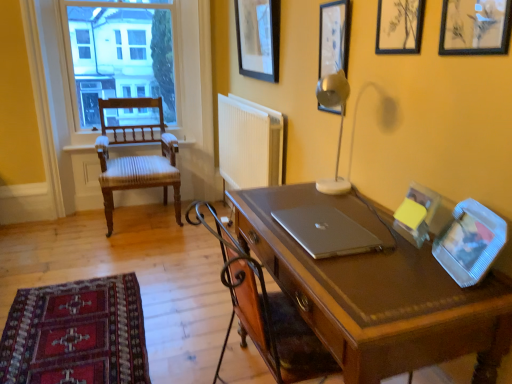
Question: Can you confirm if metallic silver picture frame at upper right, the fourth picture frame viewed from the right, is shorter than metallic silver table lamp at upper right?

Choices:
 (A) yes
 (B) no

Answer: (A)

Question: Can you confirm if metallic silver picture frame at upper right, placed as the fourth picture frame when sorted from front to back, is smaller than metallic silver table lamp at upper right?

Choices:
 (A) no
 (B) yes

Answer: (B)

Question: Can you confirm if metallic silver picture frame at upper right, placed as the fourth picture frame when sorted from front to back, is thinner than metallic silver table lamp at upper right?

Choices:
 (A) no
 (B) yes

Answer: (B)

Question: Can you confirm if metallic silver picture frame at upper right, the fourth picture frame viewed from the right, is wider than metallic silver table lamp at upper right?

Choices:
 (A) yes
 (B) no

Answer: (B)

Question: Does metallic silver picture frame at upper right, the fourth picture frame viewed from the right, lie behind metallic silver table lamp at upper right?

Choices:
 (A) no
 (B) yes

Answer: (B)

Question: Considering their positions, is wooden picture frame at upper right, which is the 3th picture frame in front-to-back order, located in front of or behind wooden chair with striped cushioning at left?

Choices:
 (A) behind
 (B) front

Answer: (B)

Question: Is point (380, 16) positioned closer to the camera than point (164, 162)?

Choices:
 (A) farther
 (B) closer

Answer: (B)

Question: Would you say wooden picture frame at upper right, the 3th picture frame from the left, is to the left or to the right of wooden chair with striped cushioning at left in the picture?

Choices:
 (A) left
 (B) right

Answer: (B)

Question: Is wooden picture frame at upper right, the 3th picture frame from the left, wider or thinner than wooden chair with striped cushioning at left?

Choices:
 (A) wide
 (B) thin

Answer: (B)

Question: In terms of width, does matte brown desk at center look wider or thinner when compared to black matte picture frame at upper right, which is the fifth picture frame in back-to-front order?

Choices:
 (A) thin
 (B) wide

Answer: (B)

Question: Relative to black matte picture frame at upper right, placed as the fifth picture frame when sorted from left to right, is matte brown desk at center in front or behind?

Choices:
 (A) front
 (B) behind

Answer: (A)

Question: From their relative heights in the image, would you say matte brown desk at center is taller or shorter than black matte picture frame at upper right, placed as the fifth picture frame when sorted from left to right?

Choices:
 (A) tall
 (B) short

Answer: (A)

Question: From the image's perspective, relative to black matte picture frame at upper right, placed as the fifth picture frame when sorted from left to right, is matte brown desk at center above or below?

Choices:
 (A) above
 (B) below

Answer: (B)

Question: Considering the positions of matte brown desk at center and metallic silver picture frame at upper right, the fourth picture frame viewed from the right, in the image, is matte brown desk at center wider or thinner than metallic silver picture frame at upper right, the fourth picture frame viewed from the right,?

Choices:
 (A) wide
 (B) thin

Answer: (A)

Question: Visually, is matte brown desk at center positioned to the left or to the right of metallic silver picture frame at upper right, the second picture frame positioned from the left?

Choices:
 (A) left
 (B) right

Answer: (A)